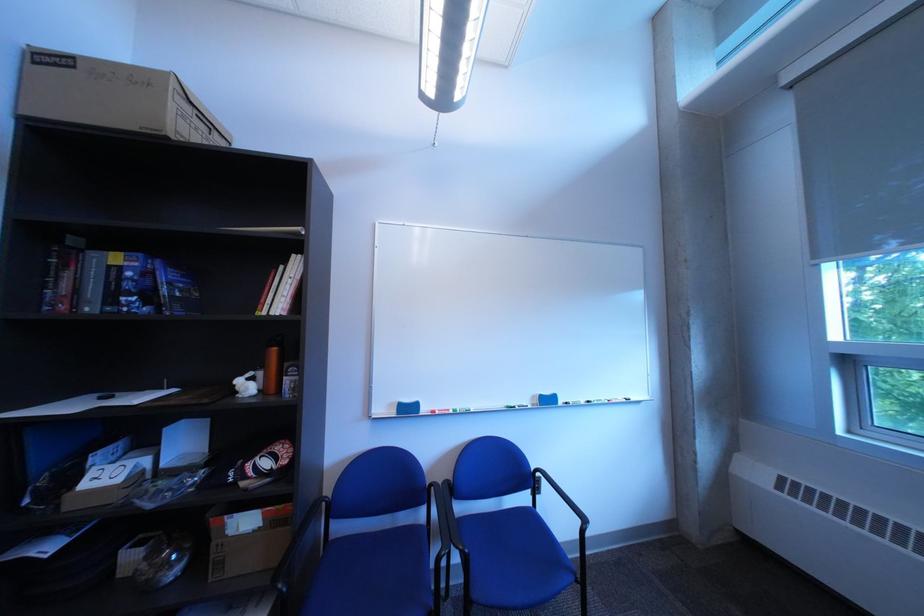
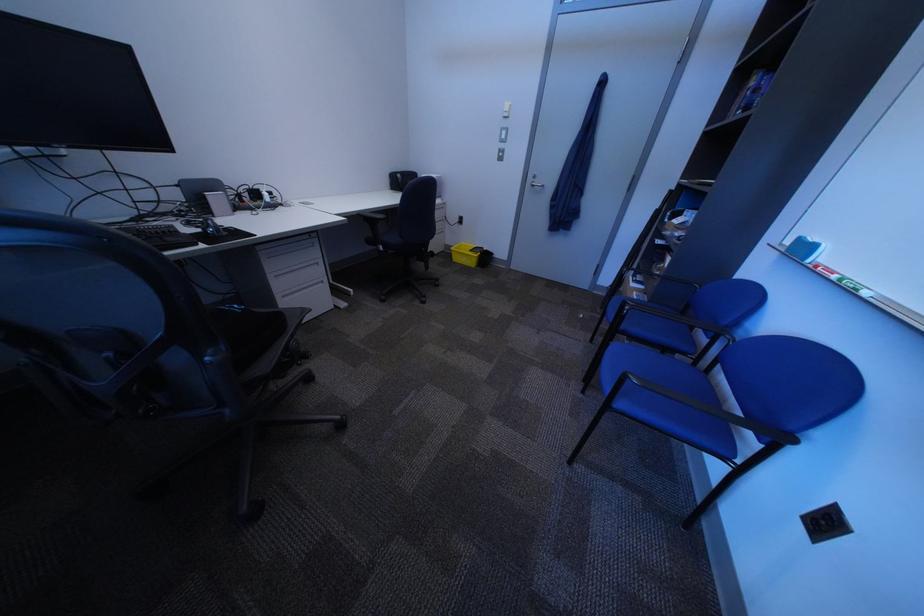
In the second image, find the point that corresponds to the point at 467,413 in the first image.

(849, 278)